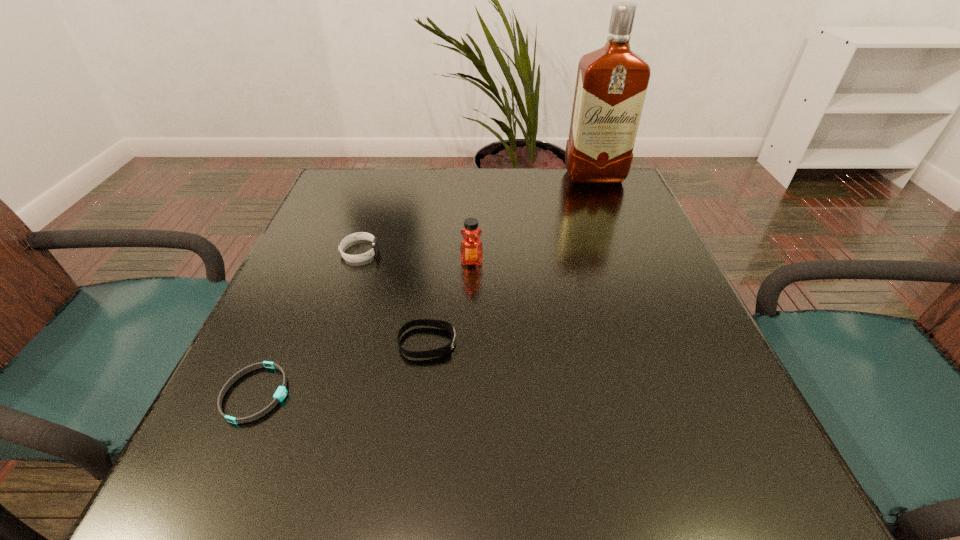
I want to click on free spot that satisfies the following two spatial constraints: 1. on the front label of the fourth object from left to right; 2. on the buckle of the shortest wristband, so click(468, 394).

What are the coordinates of `free space that satisfies the following two spatial constraints: 1. on the front label of the fourth shortest object; 2. on the buckle of the nearest wristband` in the screenshot? It's located at (468, 394).